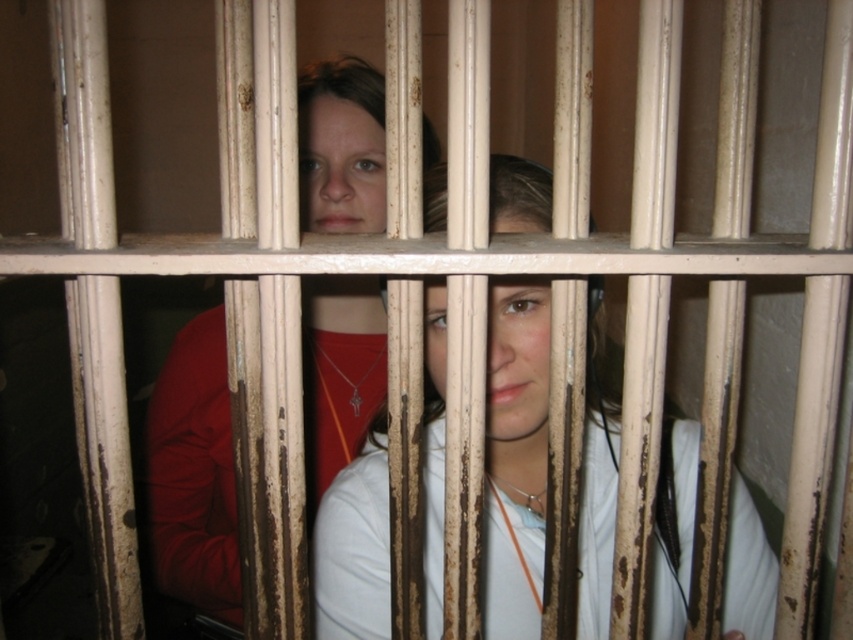
Question: Does white matte shirt at center have a larger size compared to matte red shirt at center?

Choices:
 (A) yes
 (B) no

Answer: (B)

Question: Does white matte shirt at center have a lesser width compared to matte red shirt at center?

Choices:
 (A) no
 (B) yes

Answer: (A)

Question: Which of the following is the closest to the observer?

Choices:
 (A) (503, 477)
 (B) (358, 403)

Answer: (A)

Question: Which of the following is the farthest from the observer?

Choices:
 (A) (352, 396)
 (B) (343, 508)

Answer: (A)

Question: Is white matte shirt at center positioned at the back of matte red shirt at center?

Choices:
 (A) yes
 (B) no

Answer: (B)

Question: Among these objects, which one is nearest to the camera?

Choices:
 (A) matte red shirt at center
 (B) white matte shirt at center

Answer: (B)